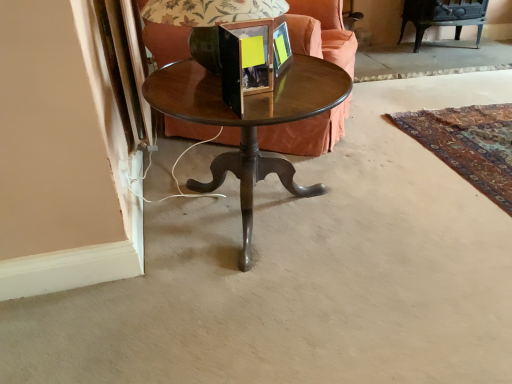
Find the location of a particular element. The height and width of the screenshot is (384, 512). vacant space situated above wooden round table at center (from a real-world perspective) is located at coordinates (271, 84).